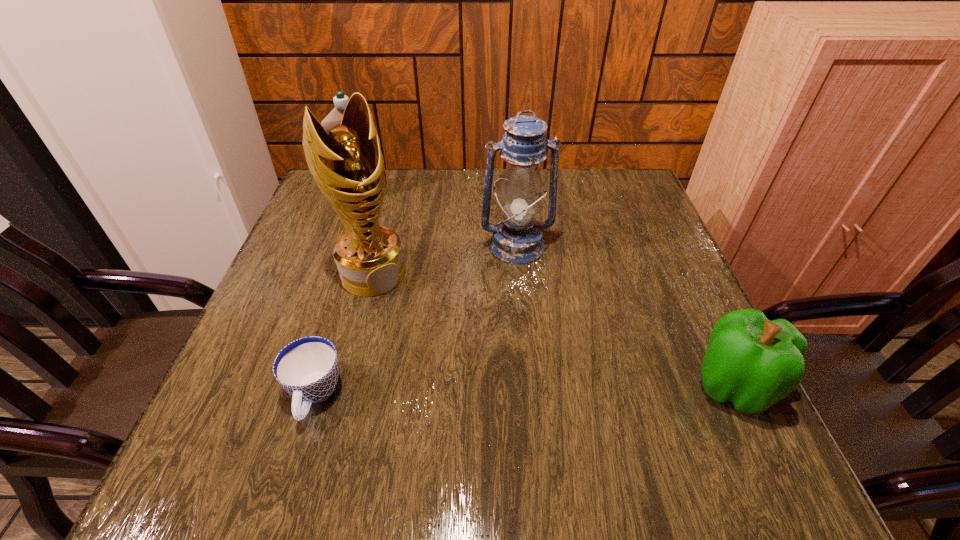
Where is `free point between the second tallest object and the detergent`? This screenshot has height=540, width=960. free point between the second tallest object and the detergent is located at coordinates (439, 219).

Identify the location of vacant region between the farthest object and the second shortest object. Image resolution: width=960 pixels, height=540 pixels. (546, 289).

Locate an element on the screen. The width and height of the screenshot is (960, 540). vacant space that is in between the detergent and the fourth object from left to right is located at coordinates (439, 219).

Find the location of `the closest object to the second shortest object`. the closest object to the second shortest object is located at coordinates click(517, 239).

Locate which object ranks second in proximity to the award. Please provide its 2D coordinates. Your answer should be formatted as a tuple, i.e. [(x, y)], where the tuple contains the x and y coordinates of a point satisfying the conditions above.

[(517, 239)]

Image resolution: width=960 pixels, height=540 pixels. I want to click on free location that satisfies the following two spatial constraints: 1. on the front side of the farthest object; 2. on the left side of the award, so pyautogui.click(x=333, y=273).

Locate an element on the screen. vacant space that satisfies the following two spatial constraints: 1. on the front side of the bell pepper; 2. on the left side of the lantern is located at coordinates (530, 386).